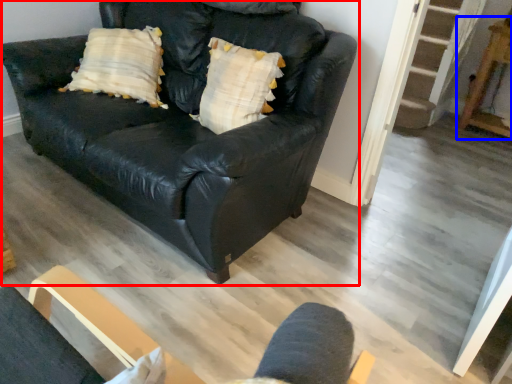
Question: Among these objects, which one is nearest to the camera, studio couch (highlighted by a red box) or table (highlighted by a blue box)?

Choices:
 (A) studio couch
 (B) table

Answer: (A)